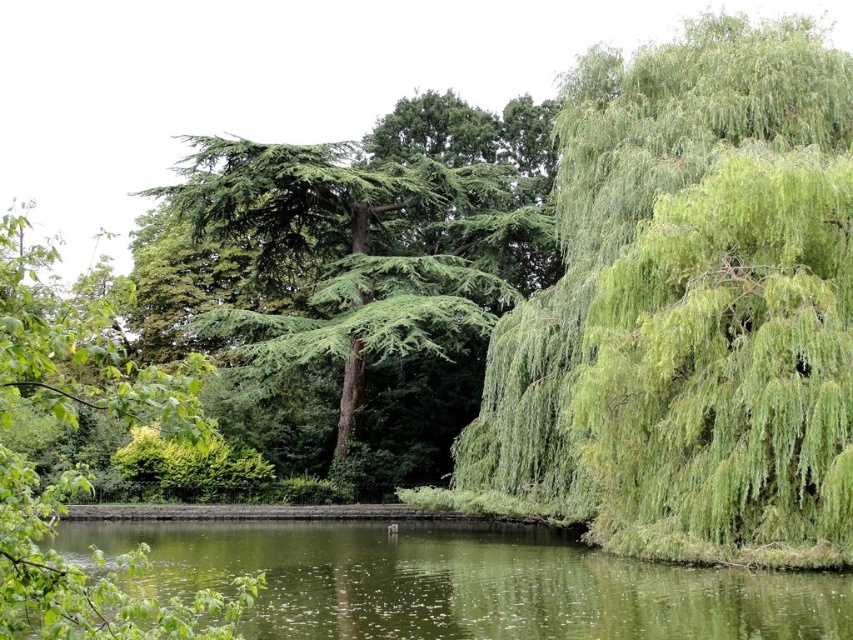
You are a bird looking for a nesting spot. You see the green leafy willow at right and the green textured tree at upper left. Which tree would provide more space for a nest?

The green textured tree at upper left provides more space for a nest because it occupies more space than the green leafy willow at right according to the description.

You are standing at the edge of the pond and want to take a photo of both the green liquid water at center and the green textured tree at upper left. Which object should you frame first to ensure both are in the shot?

You should frame the green textured tree at upper left first because the green liquid water at center is positioned to the right of it, so by starting with the tree, you can adjust the camera to include both objects in the frame.

You are a drone operator trying to capture a photo of the pond. The drone is currently at the coordinates of the weeping willow tree on the right. Which direction should you move the drone to get a clear shot of the green liquid water at center?

The green liquid water at center is located at point (461, 582), so you should move the drone towards the center of the image from the weeping willow tree on the right to capture the water.